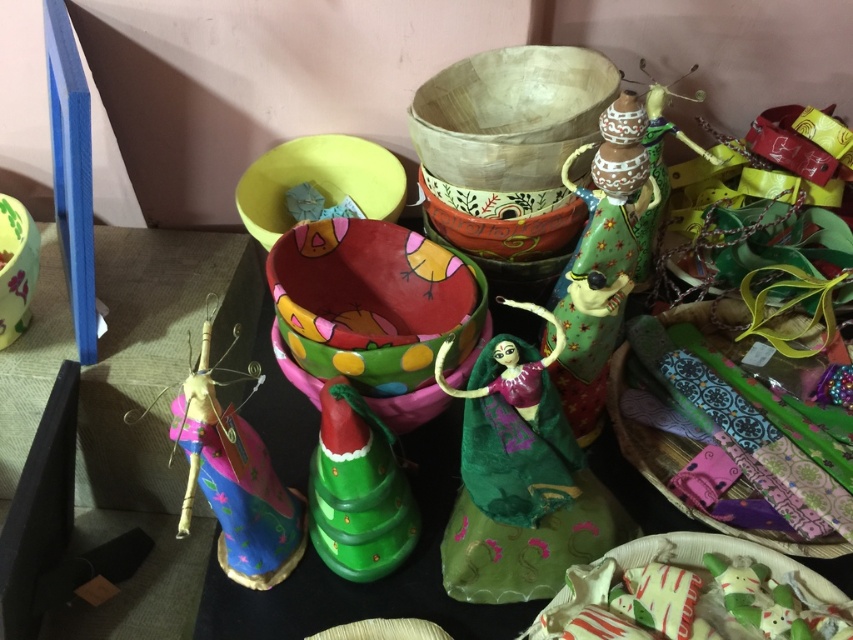
Question: Is green painted wood at center behind green fabric doll at center?

Choices:
 (A) yes
 (B) no

Answer: (A)

Question: From the image, what is the correct spatial relationship of green fabric doll at center in relation to green matte cone at center?

Choices:
 (A) right
 (B) left

Answer: (A)

Question: Is textured fabric bag at right to the left of green matte cone at center from the viewer's perspective?

Choices:
 (A) yes
 (B) no

Answer: (B)

Question: Which point is closer to the camera taking this photo?

Choices:
 (A) (590, 292)
 (B) (314, 545)
 (C) (788, 436)

Answer: (A)

Question: Which object appears closest to the camera in this image?

Choices:
 (A) green matte cone at center
 (B) textured fabric bag at right
 (C) green painted wood at center

Answer: (C)

Question: Which object appears closest to the camera in this image?

Choices:
 (A) green matte cone at center
 (B) textured fabric bag at right
 (C) green fabric doll at center

Answer: (C)